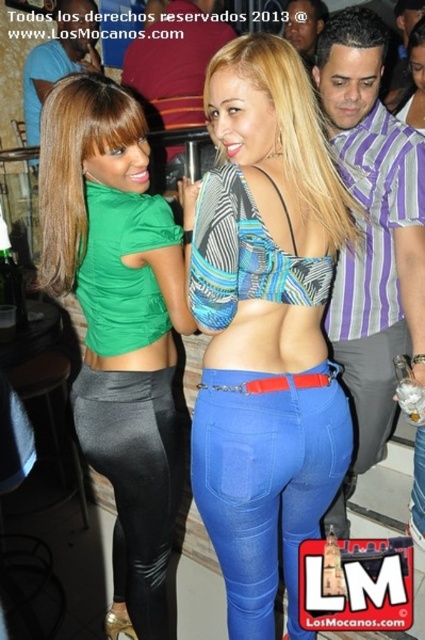
Question: Is patterned fabric bikini top at center bigger than blue denim jeans at center?

Choices:
 (A) yes
 (B) no

Answer: (A)

Question: Based on their relative distances, which object is farther from the jeans at center?

Choices:
 (A) black leather leggings at lower left
 (B) green matte leggings at center
 (C) patterned fabric bikini top at center
 (D) blue denim jeans at center

Answer: (B)

Question: Estimate the real-world distances between objects in this image. Which object is closer to the blue denim jeans at center?

Choices:
 (A) black leather leggings at lower left
 (B) green matte leggings at center
 (C) patterned fabric bikini top at center

Answer: (C)

Question: Based on their relative distances, which object is nearer to the blue denim jeans at center?

Choices:
 (A) green matte leggings at center
 (B) patterned fabric bikini top at center
 (C) jeans at center

Answer: (B)

Question: Is green matte leggings at center above jeans at center?

Choices:
 (A) no
 (B) yes

Answer: (B)

Question: Is the position of blue denim jeans at center less distant than that of jeans at center?

Choices:
 (A) yes
 (B) no

Answer: (A)